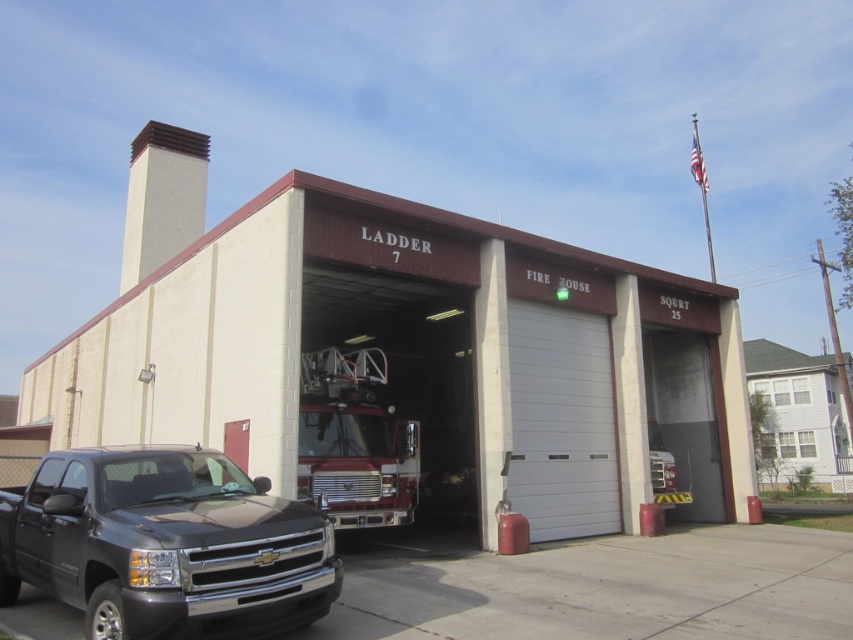
Question: Is white smooth fire station at center smaller than white smooth garage door at center?

Choices:
 (A) yes
 (B) no

Answer: (B)

Question: Is white smooth fire station at center below white smooth garage door at center?

Choices:
 (A) yes
 (B) no

Answer: (B)

Question: Considering the real-world distances, which object is farthest from the white smooth fire station at center?

Choices:
 (A) shiny red fire truck at center
 (B) black glossy pickup truck at lower left
 (C) white smooth garage door at center

Answer: (B)

Question: Which object is closer to the camera taking this photo?

Choices:
 (A) shiny red fire truck at center
 (B) white smooth fire station at center
 (C) black glossy pickup truck at lower left

Answer: (C)

Question: Does white smooth fire station at center appear on the right side of shiny red fire truck at center?

Choices:
 (A) no
 (B) yes

Answer: (A)

Question: Which object is farther from the camera taking this photo?

Choices:
 (A) white smooth garage door at center
 (B) black glossy pickup truck at lower left

Answer: (A)